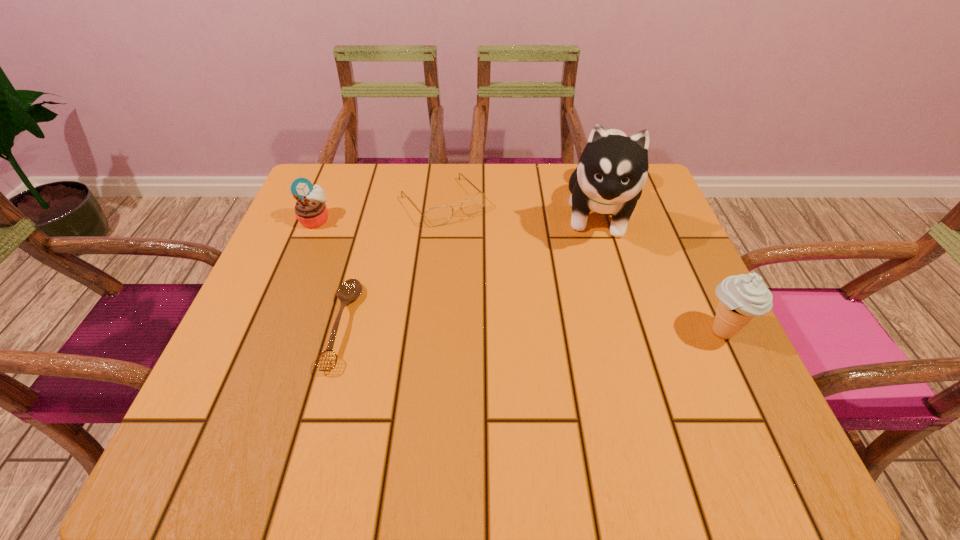
Find the location of a particular element. This screenshot has height=540, width=960. the shortest object is located at coordinates (351, 289).

You are a GUI agent. You are given a task and a screenshot of the screen. Output one action in this format:
    pyautogui.click(x=<x>, y=<y>)
    Task: Click on the fourth object from right to left
    
    Given the screenshot: What is the action you would take?
    pyautogui.click(x=351, y=289)

This screenshot has width=960, height=540. I want to click on the fourth shortest object, so click(x=742, y=297).

I want to click on the rightmost object, so click(742, 297).

This screenshot has width=960, height=540. In order to click on the tallest object in this screenshot , I will do `click(613, 168)`.

Locate an element on the screen. The height and width of the screenshot is (540, 960). the fourth object from left to right is located at coordinates point(613,168).

Identify the location of the leftmost object. The width and height of the screenshot is (960, 540). (310, 209).

I want to click on the third shortest object, so pos(310,209).

This screenshot has height=540, width=960. In order to click on the second shortest object in this screenshot , I will do `click(436, 216)`.

Image resolution: width=960 pixels, height=540 pixels. I want to click on spectacles, so click(x=436, y=216).